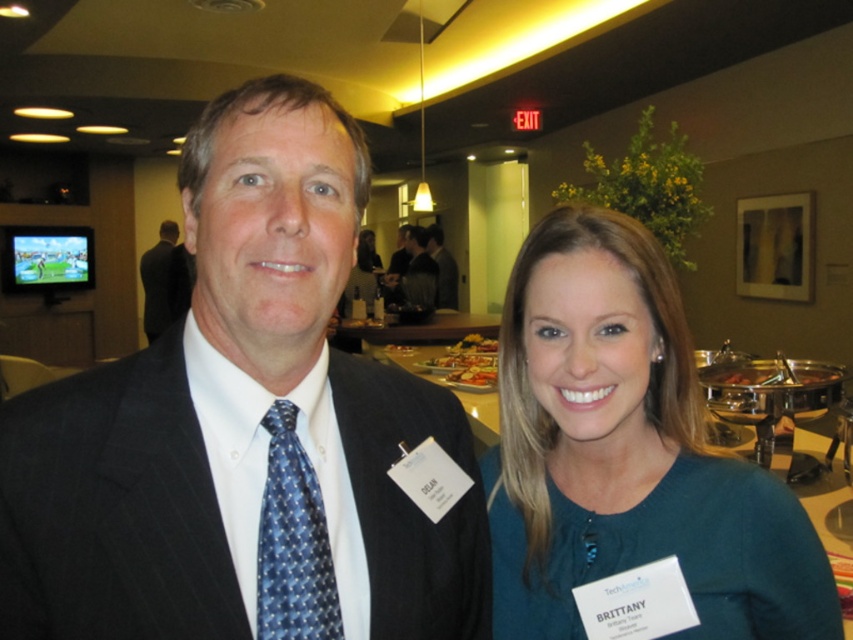
You are a photographer at a social event. You need to adjust the lighting to ensure both the blue dotted tie at center and the dark gray suit at center are well lit. Which object should you focus on first to ensure proper exposure, considering their positions?

The blue dotted tie at center is located below dark gray suit at center. Since the tie is positioned lower, it might be in shadow if the suit is already well lit. Focus on the blue dotted tie at center first to balance the lighting between both areas.

You are organizing a charity event and need to ensure that all participants have name tags visible. You notice the blue dotted tie at center and the dark gray suit at center. Which item would be more challenging to attach a name tag to, considering their size?

The blue dotted tie at center has a smaller size compared to the dark gray suit at center, so it would be more challenging to attach a name tag to the blue dotted tie at center due to its smaller surface area.